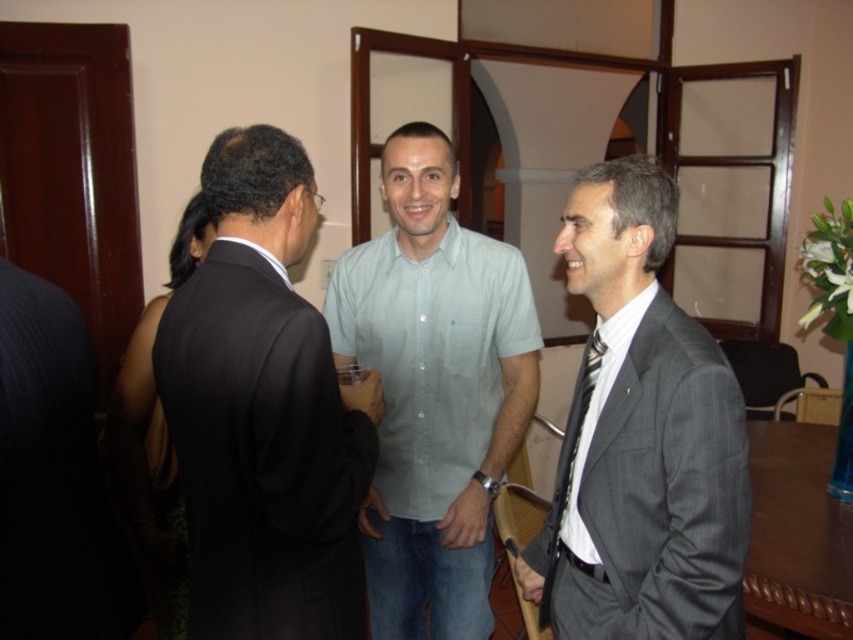
Question: Estimate the real-world distances between objects in this image. Which object is closer to the dark suit at center?

Choices:
 (A) light blue cotton shirt at center
 (B) black striped tie at right
 (C) gray pinstripe suit at right

Answer: (C)

Question: Observing the image, what is the correct spatial positioning of light blue cotton shirt at center in reference to black striped tie at right?

Choices:
 (A) left
 (B) right

Answer: (A)

Question: Is dark suit at center positioned behind black striped tie at right?

Choices:
 (A) yes
 (B) no

Answer: (B)

Question: Which point is closer to the camera?

Choices:
 (A) dark suit at center
 (B) light blue cotton shirt at center
 (C) black striped tie at right
 (D) gray pinstripe suit at right

Answer: (A)

Question: Can you confirm if gray pinstripe suit at right is positioned above light blue cotton shirt at center?

Choices:
 (A) yes
 (B) no

Answer: (A)

Question: Which object is farther from the camera taking this photo?

Choices:
 (A) gray pinstripe suit at right
 (B) dark suit at center
 (C) light blue cotton shirt at center

Answer: (C)